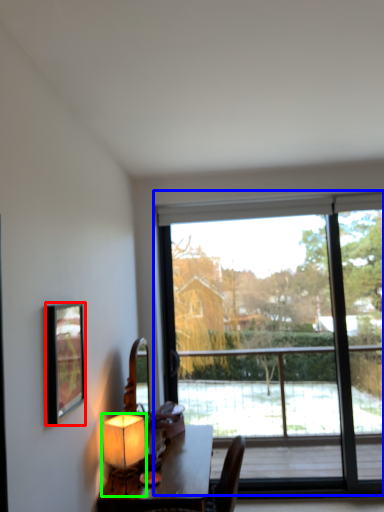
Question: Which object is positioned closest to picture frame (highlighted by a red box)? Select from window (highlighted by a blue box) and lamp (highlighted by a green box).

Choices:
 (A) window
 (B) lamp

Answer: (B)